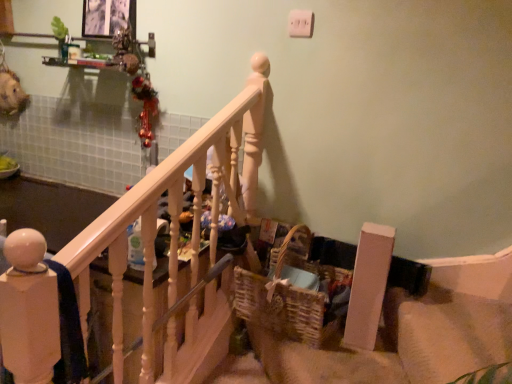
What do you see at coordinates (292, 296) in the screenshot?
I see `woven brown basket at lower center` at bounding box center [292, 296].

The width and height of the screenshot is (512, 384). Identify the location of woven brown basket at lower center. (292, 296).

Locate an element on the screen. The image size is (512, 384). white painted wood railing at upper left is located at coordinates pos(178,240).

What do you see at coordinates (178, 240) in the screenshot? The height and width of the screenshot is (384, 512). I see `white painted wood railing at upper left` at bounding box center [178, 240].

You are a GUI agent. You are given a task and a screenshot of the screen. Output one action in this format:
    pyautogui.click(x=<x>, y=<y>)
    Task: Click on the woven brown basket at lower center
    
    Given the screenshot: What is the action you would take?
    pyautogui.click(x=292, y=296)

Does woven brown basket at lower center appear on the right side of white painted wood railing at upper left?

Indeed, woven brown basket at lower center is positioned on the right side of white painted wood railing at upper left.

Considering the positions of objects woven brown basket at lower center and white painted wood railing at upper left in the image provided, who is behind, woven brown basket at lower center or white painted wood railing at upper left?

Positioned behind is woven brown basket at lower center.

Is point (305, 275) in front of point (175, 360)?

No, it is not.

From the image's perspective, does woven brown basket at lower center appear lower than white painted wood railing at upper left?

Yes, from the image's perspective, woven brown basket at lower center is below white painted wood railing at upper left.

From a real-world perspective, which object stands above the other?

white painted wood railing at upper left.

Between woven brown basket at lower center and white painted wood railing at upper left, which one has smaller width?

white painted wood railing at upper left is thinner.

In terms of height, does woven brown basket at lower center look taller or shorter compared to white painted wood railing at upper left?

Clearly, woven brown basket at lower center is shorter compared to white painted wood railing at upper left.

Between woven brown basket at lower center and white painted wood railing at upper left, which one has larger size?

white painted wood railing at upper left.

Is white painted wood railing at upper left inside woven brown basket at lower center?

No.

Is woven brown basket at lower center with white painted wood railing at upper left?

No, woven brown basket at lower center is not making contact with white painted wood railing at upper left.

Is woven brown basket at lower center oriented away from white painted wood railing at upper left?

Yes, woven brown basket at lower center is positioned with its back facing white painted wood railing at upper left.

What's the angular difference between woven brown basket at lower center and white painted wood railing at upper left's facing directions?

83.1 degrees.

In order to click on rail positioned vertically above the woven brown basket at lower center (from a real-world perspective) in this screenshot , I will do `click(178, 240)`.

Is white painted wood railing at upper left at the left side of woven brown basket at lower center?

Indeed, white painted wood railing at upper left is positioned on the left side of woven brown basket at lower center.

In the scene shown: In the image, is white painted wood railing at upper left positioned in front of or behind woven brown basket at lower center?

Visually, white painted wood railing at upper left is located in front of woven brown basket at lower center.

Considering the points (226, 141) and (310, 264), which point is in front, point (226, 141) or point (310, 264)?

The point (226, 141) is closer to the camera.

From the image's perspective, which one is positioned higher, white painted wood railing at upper left or woven brown basket at lower center?

From the image's view, white painted wood railing at upper left is above.

From a real-world perspective, is white painted wood railing at upper left physically above woven brown basket at lower center?

Yes.

Which of these two, white painted wood railing at upper left or woven brown basket at lower center, is wider?

woven brown basket at lower center is wider.

Does white painted wood railing at upper left have a greater height compared to woven brown basket at lower center?

Indeed, white painted wood railing at upper left has a greater height compared to woven brown basket at lower center.

In terms of size, does white painted wood railing at upper left appear bigger or smaller than woven brown basket at lower center?

In the image, white painted wood railing at upper left appears to be larger than woven brown basket at lower center.

Is white painted wood railing at upper left surrounding woven brown basket at lower center?

No, white painted wood railing at upper left does not contain woven brown basket at lower center.

Are white painted wood railing at upper left and woven brown basket at lower center beside each other?

No, white painted wood railing at upper left is not in contact with woven brown basket at lower center.

Could you tell me if white painted wood railing at upper left is facing woven brown basket at lower center?

Yes, white painted wood railing at upper left is facing woven brown basket at lower center.

Locate an element on the screen. rail that is on the left side of woven brown basket at lower center is located at coordinates (x=178, y=240).

What are the coordinates of `basket that is under the white painted wood railing at upper left (from a real-world perspective)` in the screenshot? It's located at (292, 296).

There is a woven brown basket at lower center. At what (x,y) coordinates should I click in order to perform the action: click on rail above it (from a real-world perspective). Please return your answer as a coordinate pair (x, y). Image resolution: width=512 pixels, height=384 pixels. Looking at the image, I should click on coord(178,240).